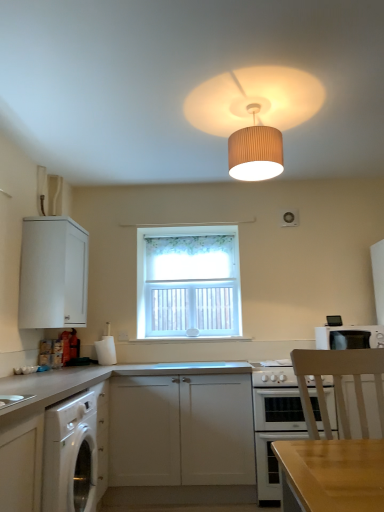
Question: Does white floral curtain at center contain white matte cabinet at lower center, which ranks as the 2th cabinetry in front-to-back order?

Choices:
 (A) yes
 (B) no

Answer: (B)

Question: Can you confirm if white floral curtain at center is smaller than white matte cabinet at lower center, the 2th cabinetry viewed from the back?

Choices:
 (A) yes
 (B) no

Answer: (A)

Question: Does white floral curtain at center have a greater height compared to white matte cabinet at lower center, the 2th cabinetry viewed from the back?

Choices:
 (A) no
 (B) yes

Answer: (B)

Question: Does white floral curtain at center come behind white matte cabinet at lower center, which ranks as the 2th cabinetry in front-to-back order?

Choices:
 (A) yes
 (B) no

Answer: (A)

Question: From a real-world perspective, does white floral curtain at center stand above white matte cabinet at lower center, the 2th cabinetry viewed from the back?

Choices:
 (A) no
 (B) yes

Answer: (B)

Question: From their relative heights in the image, would you say white glossy gas stove at lower center is taller or shorter than white floral curtain at center?

Choices:
 (A) short
 (B) tall

Answer: (A)

Question: Would you say white glossy gas stove at lower center is inside or outside white floral curtain at center?

Choices:
 (A) inside
 (B) outside

Answer: (B)

Question: Is white glossy gas stove at lower center bigger or smaller than white floral curtain at center?

Choices:
 (A) big
 (B) small

Answer: (B)

Question: From a real-world perspective, relative to white floral curtain at center, is white glossy gas stove at lower center vertically above or below?

Choices:
 (A) below
 (B) above

Answer: (A)

Question: Is white matte cabinet at lower center, which ranks as the 2th cabinetry in front-to-back order, to the left or to the right of beige pleated lampshade at upper center in the image?

Choices:
 (A) right
 (B) left

Answer: (B)

Question: Do you think white matte cabinet at lower center, the 2th cabinetry viewed from the back, is within beige pleated lampshade at upper center, or outside of it?

Choices:
 (A) outside
 (B) inside

Answer: (A)

Question: From a real-world perspective, is white matte cabinet at lower center, the 2th cabinetry viewed from the back, positioned above or below beige pleated lampshade at upper center?

Choices:
 (A) above
 (B) below

Answer: (B)

Question: Looking at their shapes, would you say white matte cabinet at lower center, which ranks as the 2th cabinetry in front-to-back order, is wider or thinner than beige pleated lampshade at upper center?

Choices:
 (A) thin
 (B) wide

Answer: (B)

Question: Would you say white matte cabinet at lower left, positioned as the 3th cabinetry in back-to-front order, is inside or outside white glossy oven at lower center?

Choices:
 (A) outside
 (B) inside

Answer: (A)

Question: From a real-world perspective, is white matte cabinet at lower left, which appears as the 1th cabinetry when viewed from the front, above or below white glossy oven at lower center?

Choices:
 (A) above
 (B) below

Answer: (A)